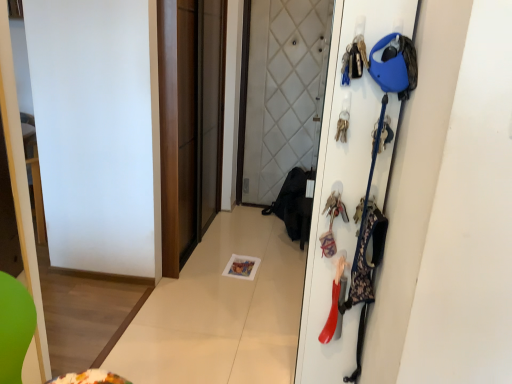
Where is `white matte door at right`? This screenshot has height=384, width=512. white matte door at right is located at coordinates (343, 182).

Where is `floral fabric bag at right, which is the 2th accessory from top to bottom`? The image size is (512, 384). floral fabric bag at right, which is the 2th accessory from top to bottom is located at coordinates [370, 180].

What do you see at coordinates (190, 122) in the screenshot? This screenshot has height=384, width=512. I see `brown matte sliding door at center` at bounding box center [190, 122].

What do you see at coordinates (333, 303) in the screenshot? The height and width of the screenshot is (384, 512). I see `rubberized plastic shoe at right, the 1th accessory from the bottom` at bounding box center [333, 303].

Image resolution: width=512 pixels, height=384 pixels. Identify the location of white matte door at right. (343, 182).

Which object is thinner, brown matte sliding door at center or metallic keychain at upper right, arranged as the 1th accessory when viewed from the top?

metallic keychain at upper right, arranged as the 1th accessory when viewed from the top.

How different are the orientations of brown matte sliding door at center and metallic keychain at upper right, arranged as the 1th accessory when viewed from the top, in degrees?

90.7 degrees.

Does point (183, 192) come behind point (344, 62)?

Yes, point (183, 192) is farther from viewer.

How many degrees apart are the facing directions of metallic keychain at upper right, arranged as the 1th accessory when viewed from the top, and white matte door at right?

There is a 89.3-degree angle between the facing directions of metallic keychain at upper right, arranged as the 1th accessory when viewed from the top, and white matte door at right.

From the image's perspective, is metallic keychain at upper right, marked as the 3th accessory in a bottom-to-top arrangement, below white matte door at right?

No, from the image's perspective, metallic keychain at upper right, marked as the 3th accessory in a bottom-to-top arrangement, is not beneath white matte door at right.

Is metallic keychain at upper right, marked as the 3th accessory in a bottom-to-top arrangement, to the left of white matte door at right from the viewer's perspective?

Indeed, metallic keychain at upper right, marked as the 3th accessory in a bottom-to-top arrangement, is positioned on the left side of white matte door at right.

From the picture: Are metallic keychain at upper right, arranged as the 1th accessory when viewed from the top, and white matte door at right located far from each other?

No, there isn't a large distance between metallic keychain at upper right, arranged as the 1th accessory when viewed from the top, and white matte door at right.

Looking at this image, from a real-world perspective, is floral fabric bag at right, which is the 2th accessory from top to bottom, above or below metallic keychain at upper right, arranged as the 1th accessory when viewed from the top?

floral fabric bag at right, which is the 2th accessory from top to bottom, is below metallic keychain at upper right, arranged as the 1th accessory when viewed from the top.

Consider the image. Is floral fabric bag at right, which is the 2th accessory from top to bottom, bigger than metallic keychain at upper right, arranged as the 1th accessory when viewed from the top?

Yes.

Is floral fabric bag at right, the 2th accessory when ordered from bottom to top, oriented away from metallic keychain at upper right, arranged as the 1th accessory when viewed from the top?

floral fabric bag at right, the 2th accessory when ordered from bottom to top, does not have its back to metallic keychain at upper right, arranged as the 1th accessory when viewed from the top.

Does point (370, 176) come closer to viewer compared to point (352, 48)?

That is False.

Is floral fabric bag at right, the 2th accessory when ordered from bottom to top, bigger or smaller than brown matte sliding door at center?

In the image, floral fabric bag at right, the 2th accessory when ordered from bottom to top, appears to be smaller than brown matte sliding door at center.

Is floral fabric bag at right, which is the 2th accessory from top to bottom, taller than brown matte sliding door at center?

In fact, floral fabric bag at right, which is the 2th accessory from top to bottom, may be shorter than brown matte sliding door at center.

From a real-world perspective, is floral fabric bag at right, the 2th accessory when ordered from bottom to top, below brown matte sliding door at center?

Yes.

Looking at the image, does rubberized plastic shoe at right, the 3th accessory from the top, seem bigger or smaller compared to metallic keychain at upper right, marked as the 3th accessory in a bottom-to-top arrangement?

In the image, rubberized plastic shoe at right, the 3th accessory from the top, appears to be larger than metallic keychain at upper right, marked as the 3th accessory in a bottom-to-top arrangement.

Is point (331, 308) closer or farther from the camera than point (361, 42)?

Point (331, 308) is farther from the camera than point (361, 42).

From a real-world perspective, which object stands above the other?

From a 3D spatial view, metallic keychain at upper right, marked as the 3th accessory in a bottom-to-top arrangement, is above.

Is rubberized plastic shoe at right, the 3th accessory from the top, taller or shorter than metallic keychain at upper right, marked as the 3th accessory in a bottom-to-top arrangement?

In the image, rubberized plastic shoe at right, the 3th accessory from the top, appears to be taller than metallic keychain at upper right, marked as the 3th accessory in a bottom-to-top arrangement.

Which point is more forward, (x=370, y=8) or (x=362, y=71)?

The point (x=370, y=8) is more forward.

You are a GUI agent. You are given a task and a screenshot of the screen. Output one action in this format:
    pyautogui.click(x=<x>, y=<y>)
    Task: Click on the door behind the metallic keychain at upper right, marked as the 3th accessory in a bottom-to-top arrangement
    
    Given the screenshot: What is the action you would take?
    pyautogui.click(x=343, y=182)

Can you confirm if white matte door at right is smaller than metallic keychain at upper right, arranged as the 1th accessory when viewed from the top?

Actually, white matte door at right might be larger than metallic keychain at upper right, arranged as the 1th accessory when viewed from the top.

Considering the relative sizes of white matte door at right and metallic keychain at upper right, marked as the 3th accessory in a bottom-to-top arrangement, in the image provided, is white matte door at right taller than metallic keychain at upper right, marked as the 3th accessory in a bottom-to-top arrangement,?

Indeed, white matte door at right has a greater height compared to metallic keychain at upper right, marked as the 3th accessory in a bottom-to-top arrangement.

Image resolution: width=512 pixels, height=384 pixels. I want to click on screen door that is on the left side of white matte door at right, so click(190, 122).

Is white matte door at right far from brown matte sliding door at center?

Absolutely, white matte door at right is distant from brown matte sliding door at center.

Considering the sizes of objects white matte door at right and brown matte sliding door at center in the image provided, who is taller, white matte door at right or brown matte sliding door at center?

Standing taller between the two is brown matte sliding door at center.

This screenshot has height=384, width=512. Identify the location of screen door on the left of metallic keychain at upper right, arranged as the 1th accessory when viewed from the top. (190, 122).

At what (x,y) coordinates should I click in order to perform the action: click on door below the metallic keychain at upper right, marked as the 3th accessory in a bottom-to-top arrangement (from the image's perspective). Please return your answer as a coordinate pair (x, y). This screenshot has width=512, height=384. Looking at the image, I should click on (343, 182).

Based on the photo, estimate the real-world distances between objects in this image. Which object is closer to brown matte sliding door at center, rubberized plastic shoe at right, the 1th accessory from the bottom, or white matte door at right?

white matte door at right.

When comparing their distances from brown matte sliding door at center, does white matte door at right or metallic keychain at upper right, marked as the 3th accessory in a bottom-to-top arrangement, seem further?

The object further to brown matte sliding door at center is metallic keychain at upper right, marked as the 3th accessory in a bottom-to-top arrangement.

When comparing their distances from metallic keychain at upper right, arranged as the 1th accessory when viewed from the top, does rubberized plastic shoe at right, the 3th accessory from the top, or brown matte sliding door at center seem closer?

Among the two, rubberized plastic shoe at right, the 3th accessory from the top, is located nearer to metallic keychain at upper right, arranged as the 1th accessory when viewed from the top.

When comparing their distances from metallic keychain at upper right, marked as the 3th accessory in a bottom-to-top arrangement, does brown matte sliding door at center or floral fabric bag at right, which is the 2th accessory from top to bottom, seem closer?

Based on the image, floral fabric bag at right, which is the 2th accessory from top to bottom, appears to be nearer to metallic keychain at upper right, marked as the 3th accessory in a bottom-to-top arrangement.

Based on their spatial positions, is brown matte sliding door at center or white matte door at right further from metallic keychain at upper right, marked as the 3th accessory in a bottom-to-top arrangement?

Based on the image, brown matte sliding door at center appears to be further to metallic keychain at upper right, marked as the 3th accessory in a bottom-to-top arrangement.

Estimate the real-world distances between objects in this image. Which object is closer to brown matte sliding door at center, floral fabric bag at right, the 2th accessory when ordered from bottom to top, or rubberized plastic shoe at right, the 3th accessory from the top?

rubberized plastic shoe at right, the 3th accessory from the top, lies closer to brown matte sliding door at center than the other object.

When comparing their distances from white matte door at right, does metallic keychain at upper right, arranged as the 1th accessory when viewed from the top, or rubberized plastic shoe at right, the 1th accessory from the bottom, seem further?

metallic keychain at upper right, arranged as the 1th accessory when viewed from the top, is further to white matte door at right.

Which object lies further to the anchor point floral fabric bag at right, which is the 2th accessory from top to bottom, white matte door at right or metallic keychain at upper right, marked as the 3th accessory in a bottom-to-top arrangement?

metallic keychain at upper right, marked as the 3th accessory in a bottom-to-top arrangement, is further to floral fabric bag at right, which is the 2th accessory from top to bottom.

Identify the location of accessory that lies between metallic keychain at upper right, arranged as the 1th accessory when viewed from the top, and rubberized plastic shoe at right, the 1th accessory from the bottom, from top to bottom. This screenshot has width=512, height=384. (370, 180).

Where is `accessory positioned between floral fabric bag at right, which is the 2th accessory from top to bottom, and brown matte sliding door at center from near to far`? The width and height of the screenshot is (512, 384). accessory positioned between floral fabric bag at right, which is the 2th accessory from top to bottom, and brown matte sliding door at center from near to far is located at coordinates (333, 303).

Image resolution: width=512 pixels, height=384 pixels. In order to click on door between metallic keychain at upper right, marked as the 3th accessory in a bottom-to-top arrangement, and rubberized plastic shoe at right, the 3th accessory from the top, vertically in this screenshot , I will do `click(343, 182)`.

What are the coordinates of `accessory positioned between white matte door at right and rubberized plastic shoe at right, the 3th accessory from the top, from near to far` in the screenshot? It's located at (370, 180).